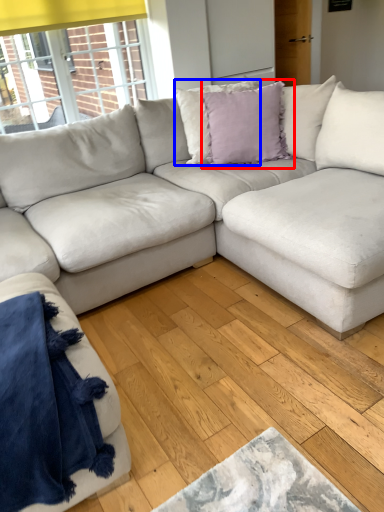
Question: Which object is closer to the camera taking this photo, pillow (highlighted by a red box) or pillow (highlighted by a blue box)?

Choices:
 (A) pillow
 (B) pillow

Answer: (A)